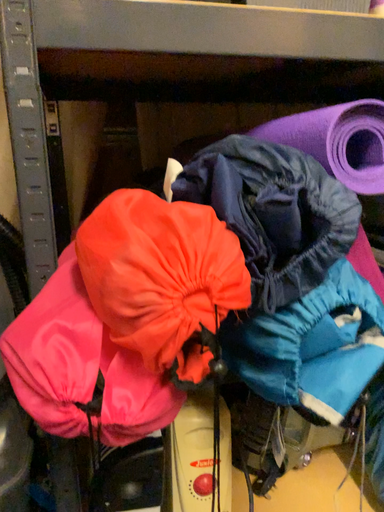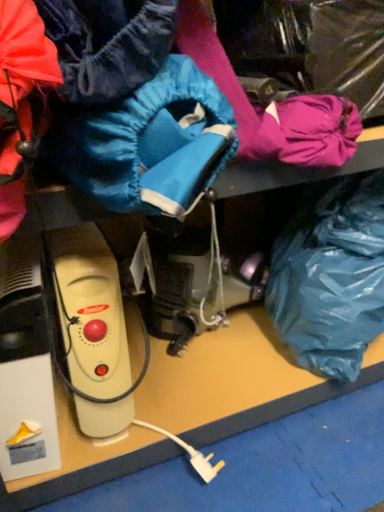
Question: Which way did the camera rotate in the video?

Choices:
 (A) rotated upward
 (B) rotated downward

Answer: (B)